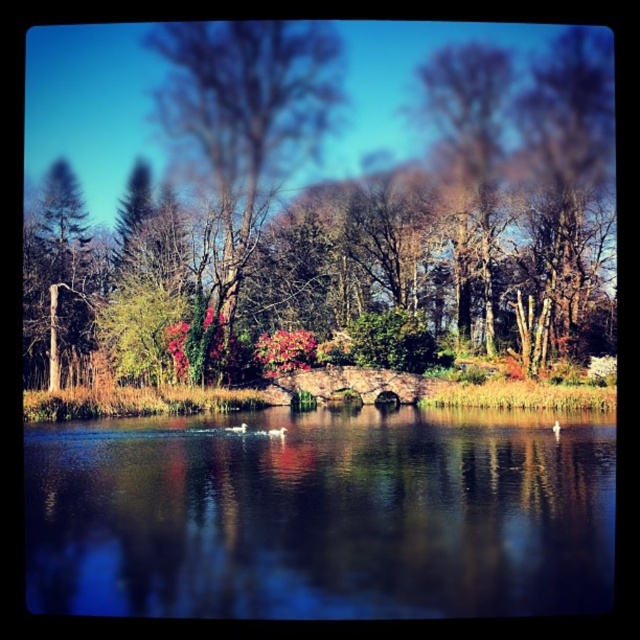
You are standing at the point labeled as point (x=321, y=516) in the image. What type of surface are you standing on?

The point (x=321, y=516) is on transparent water at center, so you are standing on transparent water.

You are a painter standing at the edge of the transparent water at center. You want to paint the green matte tree at left. Which object is wider from your perspective?

The transparent water at center might be wider than green matte tree at left according to the description.

You are standing at the stone bridge and want to walk towards the point labeled as point (237, 269). Is this point closer to you than the other point labeled point (227, 104)?

Yes, point (237, 269) is in front of point (227, 104), so it is closer to you.